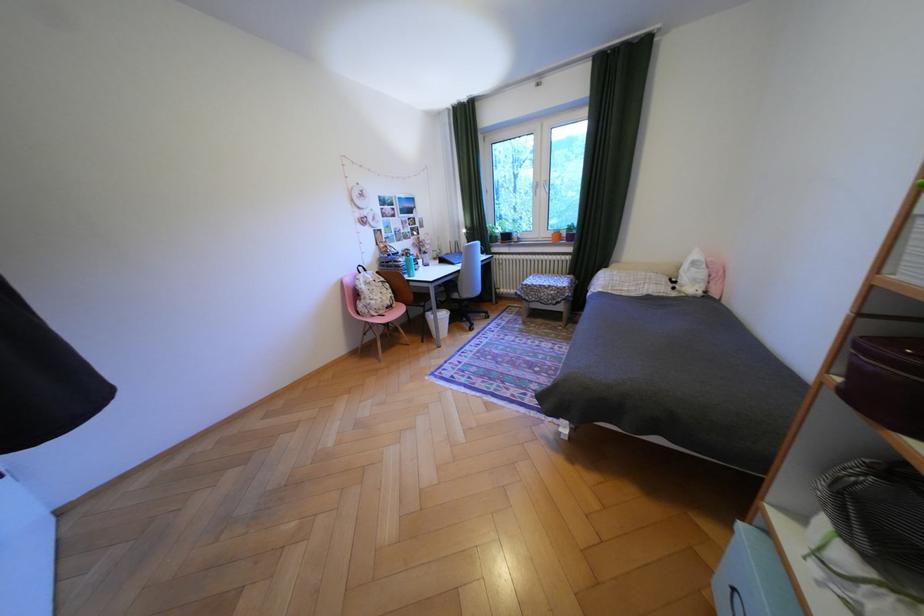
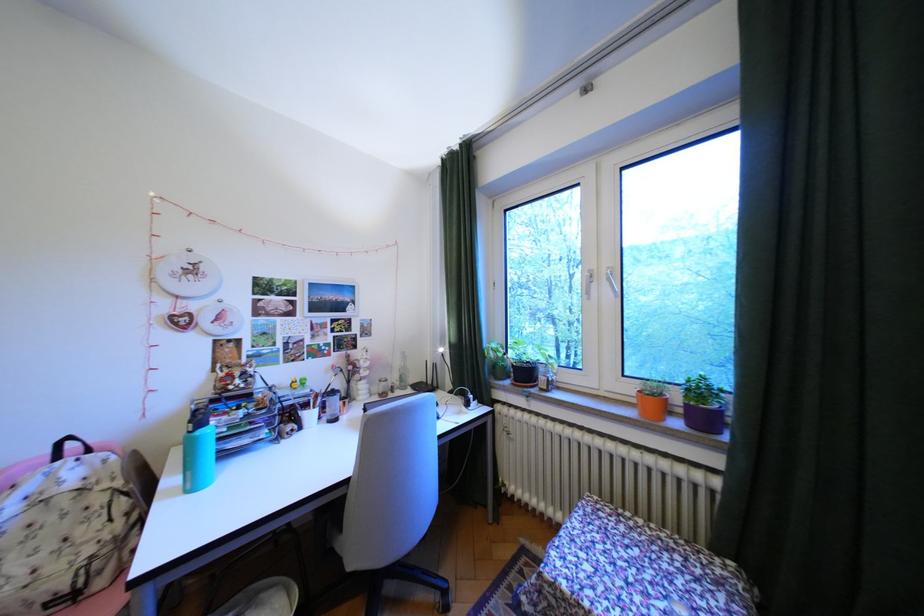
Where in the second image is the point corresponding to the point at 538,285 from the first image?

(564, 585)